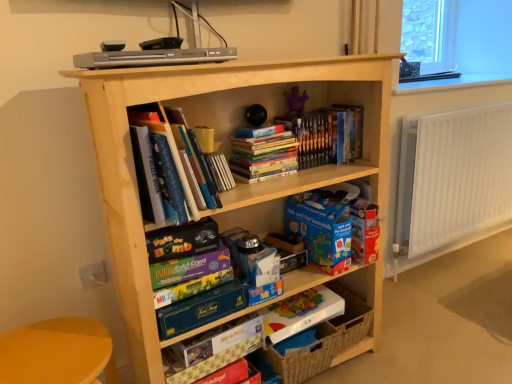
This screenshot has height=384, width=512. Find the location of `hardcover books at upper left, which ranks as the third book in right-to-left order`. hardcover books at upper left, which ranks as the third book in right-to-left order is located at coordinates (180, 155).

Describe the element at coordinates (180, 155) in the screenshot. I see `hardcover books at upper left, marked as the 1th book in a left-to-right arrangement` at that location.

Measure the distance between point [160,245] and camera.

They are 3.87 feet apart.

The width and height of the screenshot is (512, 384). Describe the element at coordinates (182, 240) in the screenshot. I see `matte blue book at center, which is the 6th paperback book in bottom-to-top order` at that location.

This screenshot has width=512, height=384. What do you see at coordinates (295, 102) in the screenshot? I see `purple fabric toy at upper center` at bounding box center [295, 102].

Find the location of `multicolored cardboard game box at center, placed as the fourth paperback book when sorted from bottom to top`. multicolored cardboard game box at center, placed as the fourth paperback book when sorted from bottom to top is located at coordinates (189, 268).

This screenshot has height=384, width=512. Identify the location of green matte board game at center, the 2th paperback book in the bottom-to-top sequence. (201, 309).

Can you confirm if matte cardboard book at lower center, the sixth paperback book positioned from the top, is smaller than matte blue book at center, arranged as the first paperback book when viewed from the top?

Correct, matte cardboard book at lower center, the sixth paperback book positioned from the top, occupies less space than matte blue book at center, arranged as the first paperback book when viewed from the top.

From the image's perspective, between matte cardboard book at lower center, the first paperback book ordered from the bottom, and matte blue book at center, arranged as the first paperback book when viewed from the top, who is located below?

From the image's view, matte cardboard book at lower center, the first paperback book ordered from the bottom, is below.

Where is `the 5th paperback book below when counting from the matte blue book at center, which is the 6th paperback book in bottom-to-top order (from the image's perspective)`? the 5th paperback book below when counting from the matte blue book at center, which is the 6th paperback book in bottom-to-top order (from the image's perspective) is located at coordinates (212, 349).

Is matte cardboard book at lower center, the first paperback book ordered from the bottom, facing towards matte blue book at center, arranged as the first paperback book when viewed from the top?

No, matte cardboard book at lower center, the first paperback book ordered from the bottom, does not turn towards matte blue book at center, arranged as the first paperback book when viewed from the top.

Based on the photo, is multicolored cardboard game box at center, which ranks as the 4th paperback book in top-to-bottom order, surrounded by purple fabric toy at upper center?

Definitely not — multicolored cardboard game box at center, which ranks as the 4th paperback book in top-to-bottom order, is not inside purple fabric toy at upper center.

Which of these two, purple fabric toy at upper center or multicolored cardboard game box at center, acting as the 3th paperback book starting from the bottom, is bigger?

Bigger between the two is multicolored cardboard game box at center, acting as the 3th paperback book starting from the bottom.

Between purple fabric toy at upper center and multicolored cardboard game box at center, acting as the 3th paperback book starting from the bottom, which one has less height?

Standing shorter between the two is multicolored cardboard game box at center, acting as the 3th paperback book starting from the bottom.

Considering the positions of objects white metallic radiator at right and purple fabric toy at upper center in the image provided, who is more to the right, white metallic radiator at right or purple fabric toy at upper center?

From the viewer's perspective, white metallic radiator at right appears more on the right side.

Would you say white metallic radiator at right contains purple fabric toy at upper center?

No, white metallic radiator at right does not contain purple fabric toy at upper center.

Considering the relative sizes of white metallic radiator at right and purple fabric toy at upper center in the image provided, is white metallic radiator at right bigger than purple fabric toy at upper center?

Indeed, white metallic radiator at right has a larger size compared to purple fabric toy at upper center.

Identify the location of toy above the white metallic radiator at right (from a real-world perspective). (295, 102).

Are multicolored cardboard game box at center, which ranks as the 4th paperback book in top-to-bottom order, and white metallic radiator at right located far from each other?

That's right, there is a large distance between multicolored cardboard game box at center, which ranks as the 4th paperback book in top-to-bottom order, and white metallic radiator at right.

Is the depth of multicolored cardboard game box at center, which ranks as the 4th paperback book in top-to-bottom order, less than that of white metallic radiator at right?

Yes, multicolored cardboard game box at center, which ranks as the 4th paperback book in top-to-bottom order, is in front of white metallic radiator at right.

Considering the relative positions of multicolored cardboard game box at center, which ranks as the 4th paperback book in top-to-bottom order, and white metallic radiator at right in the image provided, is multicolored cardboard game box at center, which ranks as the 4th paperback book in top-to-bottom order, to the left of white metallic radiator at right from the viewer's perspective?

Indeed, multicolored cardboard game box at center, which ranks as the 4th paperback book in top-to-bottom order, is positioned on the left side of white metallic radiator at right.

Which point is more forward, (167, 296) or (415, 242)?

The point (167, 296) is closer.

Is hardcover books at upper center, placed as the third book when sorted from left to right, turned away from purple fabric toy at upper center?

No, hardcover books at upper center, placed as the third book when sorted from left to right, is not facing away from purple fabric toy at upper center.

From the image's perspective, who appears lower, hardcover books at upper center, the 1th book viewed from the right, or purple fabric toy at upper center?

hardcover books at upper center, the 1th book viewed from the right.

Is purple fabric toy at upper center located within hardcover books at upper center, the 1th book viewed from the right?

Actually, purple fabric toy at upper center is outside hardcover books at upper center, the 1th book viewed from the right.

In the scene shown: From a real-world perspective, which object rests below the other?

green matte board game at center, the 2th paperback book in the bottom-to-top sequence, from a real-world perspective.

Looking at this image, measure the distance between multicolored cardboard game box at center, acting as the 3th paperback book starting from the bottom, and green matte board game at center, the 2th paperback book in the bottom-to-top sequence.

multicolored cardboard game box at center, acting as the 3th paperback book starting from the bottom, is 1.72 inches away from green matte board game at center, the 2th paperback book in the bottom-to-top sequence.

Does multicolored cardboard game box at center, which ranks as the 4th paperback book in top-to-bottom order, have a larger size compared to green matte board game at center, the 2th paperback book in the bottom-to-top sequence?

No, multicolored cardboard game box at center, which ranks as the 4th paperback book in top-to-bottom order, is not bigger than green matte board game at center, the 2th paperback book in the bottom-to-top sequence.

Which is farther, (207, 283) or (214, 296)?

Positioned behind is point (207, 283).

Is matte blue book at center, which is the 6th paperback book in bottom-to-top order, in front of multicolored cardboard game box at center, placed as the fourth paperback book when sorted from bottom to top?

That is True.

Which of these two, matte blue book at center, arranged as the first paperback book when viewed from the top, or multicolored cardboard game box at center, placed as the fourth paperback book when sorted from bottom to top, stands taller?

matte blue book at center, arranged as the first paperback book when viewed from the top.

Does matte blue book at center, arranged as the first paperback book when viewed from the top, have a larger size compared to multicolored cardboard game box at center, the third paperback book in the top-to-bottom sequence?

Correct, matte blue book at center, arranged as the first paperback book when viewed from the top, is larger in size than multicolored cardboard game box at center, the third paperback book in the top-to-bottom sequence.

From the matte cardboard book at lower center, the sixth paperback book positioned from the top, count the 4th paperback book to the left and point to it. Please provide its 2D coordinates.

[(182, 240)]

Identify the location of the 4th paperback book positioned below the purple fabric toy at upper center (from a real-world perspective). point(191,288).

Looking at the image, which one is located further to yellow plastic table at lower left, blue cardboard book at center, which is the 5th paperback book in bottom-to-top order, or white metallic radiator at right?

white metallic radiator at right.

From the picture: Looking at the image, which one is located further to matte blue book at center, arranged as the first paperback book when viewed from the top, transparent glass window at upper right or clear glass window sill at upper right?

transparent glass window at upper right lies further to matte blue book at center, arranged as the first paperback book when viewed from the top, than the other object.

Looking at the image, which one is located closer to multicolored cardboard game box at center, which ranks as the 4th paperback book in top-to-bottom order, white metallic radiator at right or hardcover books at upper center, the 1th book viewed from the right?

Based on the image, hardcover books at upper center, the 1th book viewed from the right, appears to be nearer to multicolored cardboard game box at center, which ranks as the 4th paperback book in top-to-bottom order.

Based on their spatial positions, is transparent glass window at upper right or matte cardboard book at lower center, the first paperback book ordered from the bottom, closer to hardcover books at upper center, the 1th book viewed from the right?

matte cardboard book at lower center, the first paperback book ordered from the bottom.

When comparing their distances from white metallic radiator at right, does hardcover books at center, the second book from the left, or transparent glass window at upper right seem further?

hardcover books at center, the second book from the left.

From the image, which object appears to be nearer to multicolored cardboard game box at center, which ranks as the 4th paperback book in top-to-bottom order, purple fabric toy at upper center or hardcover books at upper left, which ranks as the third book in right-to-left order?

hardcover books at upper left, which ranks as the third book in right-to-left order, is positioned closer to the anchor multicolored cardboard game box at center, which ranks as the 4th paperback book in top-to-bottom order.

Considering their positions, is hardcover books at upper center, placed as the third book when sorted from left to right, positioned further to hardcover books at center, the second book viewed from the right, than white metallic radiator at right?

white metallic radiator at right lies further to hardcover books at center, the second book viewed from the right, than the other object.

From the picture: Considering their positions, is hardcover books at center, the second book viewed from the right, positioned closer to yellow plastic table at lower left than woven brown basket at lower right?

woven brown basket at lower right.

You are a GUI agent. You are given a task and a screenshot of the screen. Output one action in this format:
    pyautogui.click(x=<x>, y=<y>)
    Task: Click on the bookcase between matte blue book at center, which is the 6th paperback book in bottom-to-top order, and matte cardboard book at lower center, the first paperback book ordered from the bottom, from top to bottom
    
    Given the screenshot: What is the action you would take?
    pyautogui.click(x=220, y=131)

At what (x,y) coordinates should I click in order to perform the action: click on toy situated between multicolored cardboard game box at center, which ranks as the 4th paperback book in top-to-bottom order, and white metallic radiator at right from left to right. Please return your answer as a coordinate pair (x, y). The image size is (512, 384). Looking at the image, I should click on (295, 102).

Identify the location of bookcase between matte blue book at center, which is the 6th paperback book in bottom-to-top order, and yellow plastic table at lower left in the up-down direction. The width and height of the screenshot is (512, 384). (220, 131).

You are a GUI agent. You are given a task and a screenshot of the screen. Output one action in this format:
    pyautogui.click(x=<x>, y=<y>)
    Task: Click on the paperback book between light wood bookcase at center and clear glass window sill at upper right in the horizontal direction
    Image resolution: width=512 pixels, height=384 pixels.
    Given the screenshot: What is the action you would take?
    pyautogui.click(x=321, y=230)